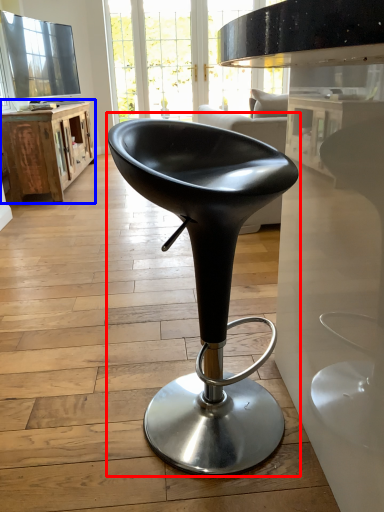
Question: Among these objects, which one is farthest to the camera, chair (highlighted by a red box) or table (highlighted by a blue box)?

Choices:
 (A) chair
 (B) table

Answer: (B)